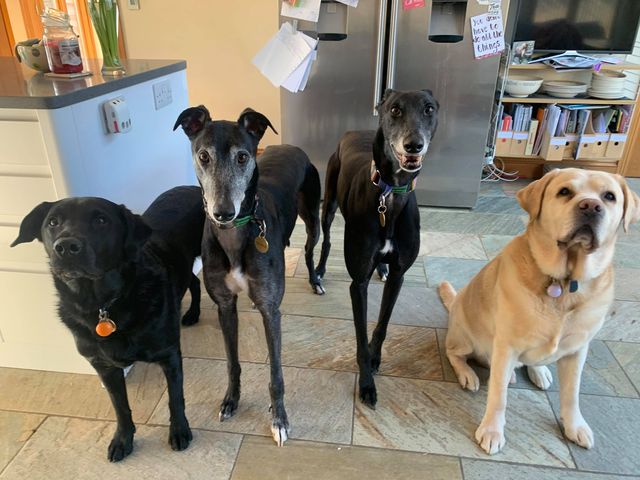
Where is `bowls`? bowls is located at coordinates (528, 84), (563, 92), (609, 92).